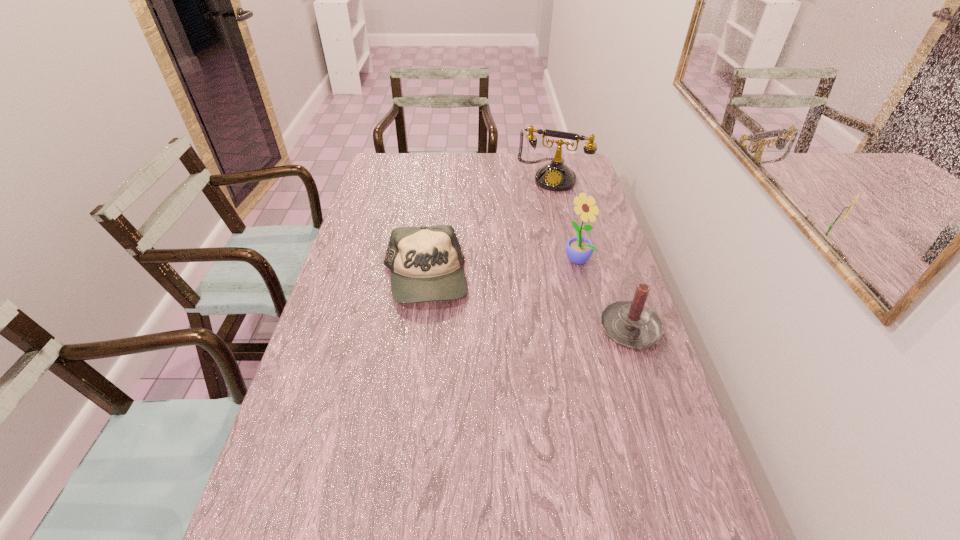
This screenshot has width=960, height=540. What are the coordinates of `free space on the desktop that is between the shortest object and the candle and is positioned on the dial of the farthest object` in the screenshot? It's located at (499, 299).

Image resolution: width=960 pixels, height=540 pixels. I want to click on vacant spot on the desktop that is between the baseball cap and the candle and is positioned on the front-facing side of the sunflower, so click(511, 301).